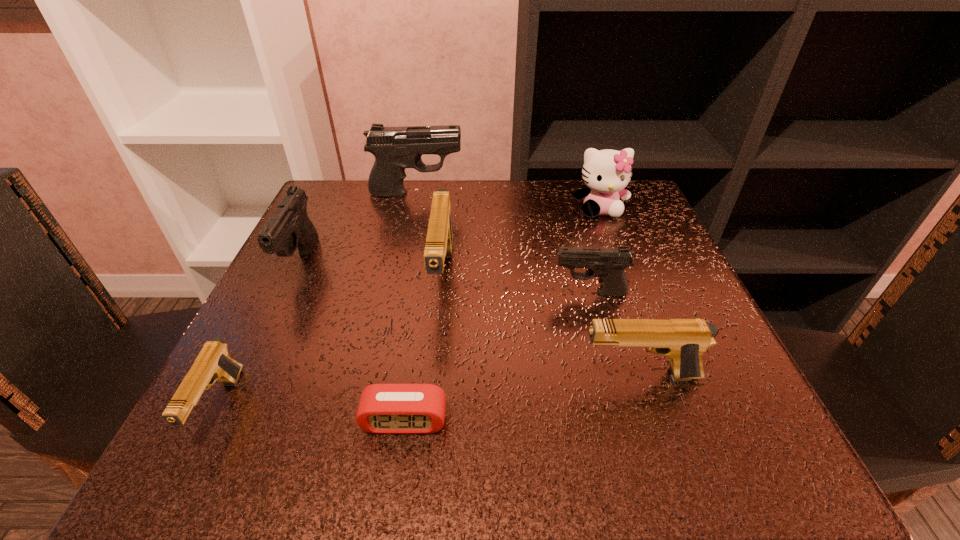
Locate an element on the screen. unoccupied area between the leftmost black pistol and the biggest black pistol is located at coordinates (359, 228).

Find the location of a particular element. free spot between the second tan pistol from left to right and the second smallest black pistol is located at coordinates (372, 270).

Locate an element on the screen. The width and height of the screenshot is (960, 540). blank region between the rightmost tan pistol and the leftmost black pistol is located at coordinates (470, 319).

Identify the location of unoccupied position between the second smallest tan pistol and the second smallest black pistol. The height and width of the screenshot is (540, 960). (470, 319).

Find the location of a particular element. object that is the nearest to the smallest tan pistol is located at coordinates (290, 228).

This screenshot has width=960, height=540. What are the coordinates of `object that is the seventh closest to the kitten` in the screenshot? It's located at (213, 363).

Identify the location of the fourth closest pistol to the leftmost tan pistol. (395, 148).

This screenshot has width=960, height=540. I want to click on pistol that is the closest one to the smallest black pistol, so click(684, 341).

The width and height of the screenshot is (960, 540). I want to click on black pistol that is the nearest to the smallest black pistol, so click(395, 148).

Select which black pistol is the second closest to the smallest black pistol. Please provide its 2D coordinates. Your answer should be formatted as a tuple, i.e. [(x, y)], where the tuple contains the x and y coordinates of a point satisfying the conditions above.

[(290, 228)]